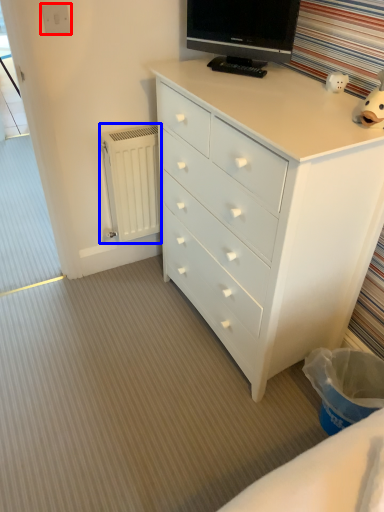
Question: Among these objects, which one is farthest to the camera, electric outlet (highlighted by a red box) or radiator (highlighted by a blue box)?

Choices:
 (A) electric outlet
 (B) radiator

Answer: (B)